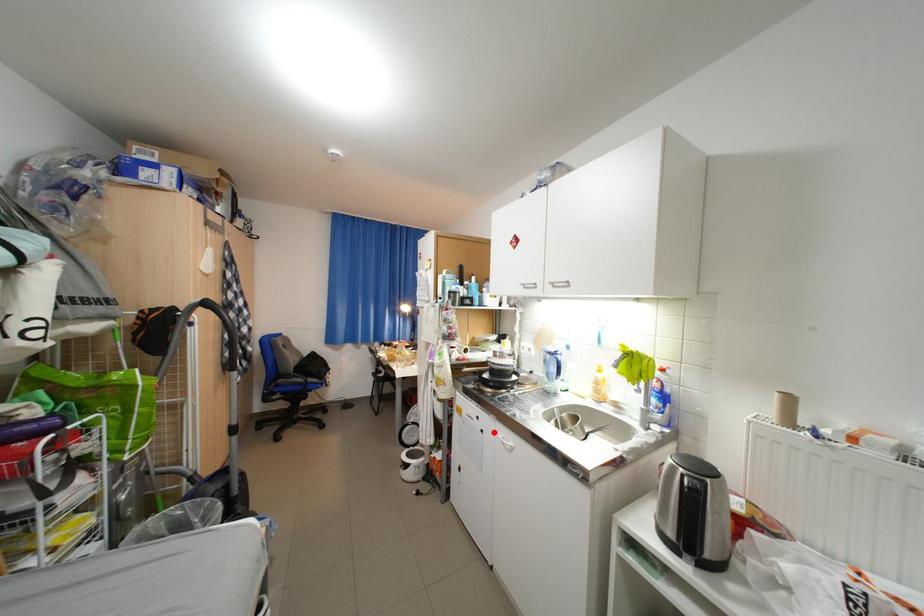
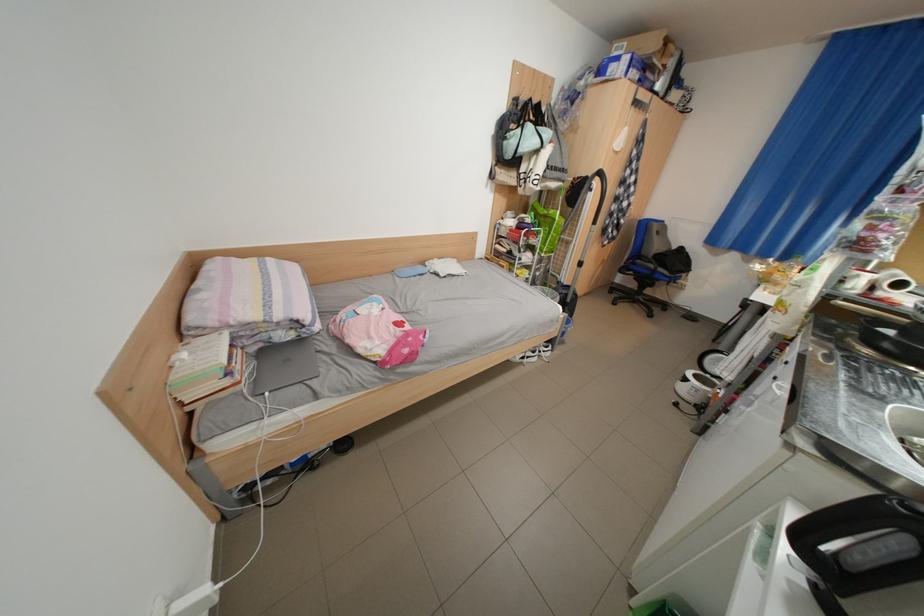
The point at the highlighted location is marked in the first image. Where is the corresponding point in the second image?

(786, 379)